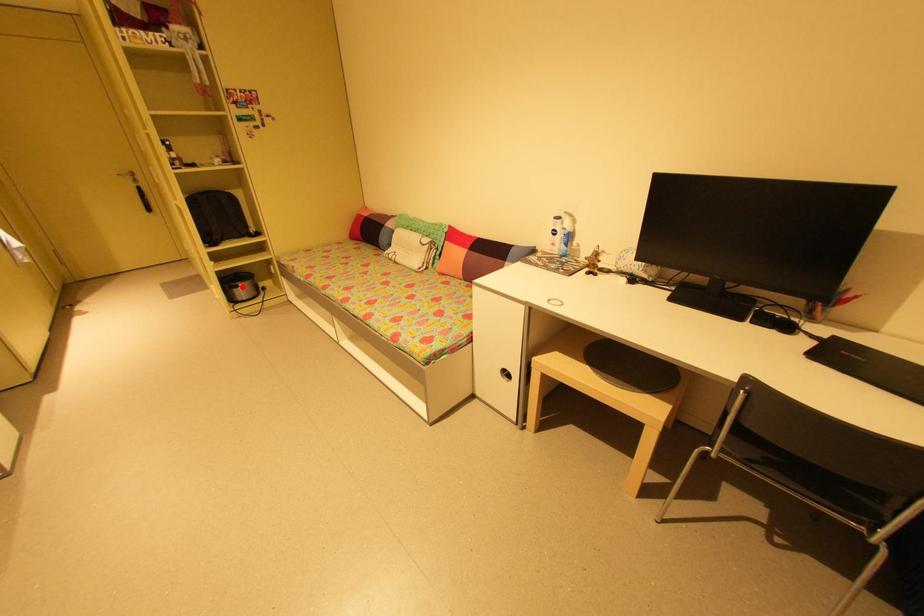
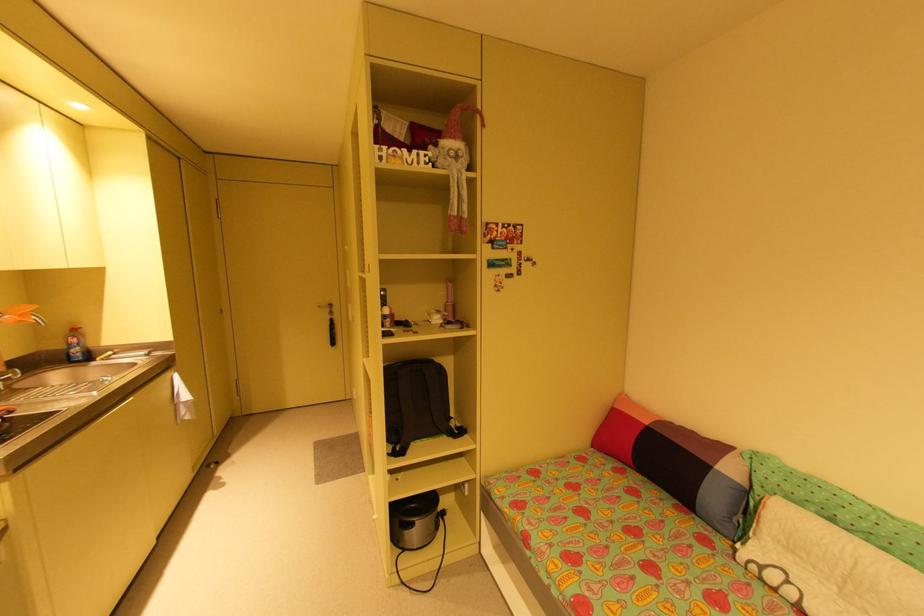
Question: I am providing you with two images of the same scene from different viewpoints. In image1, a red point is highlighted. Considering the same 3D point in image2, which of the following is correct?

Choices:
 (A) It is closer
 (B) It is farther

Answer: (B)